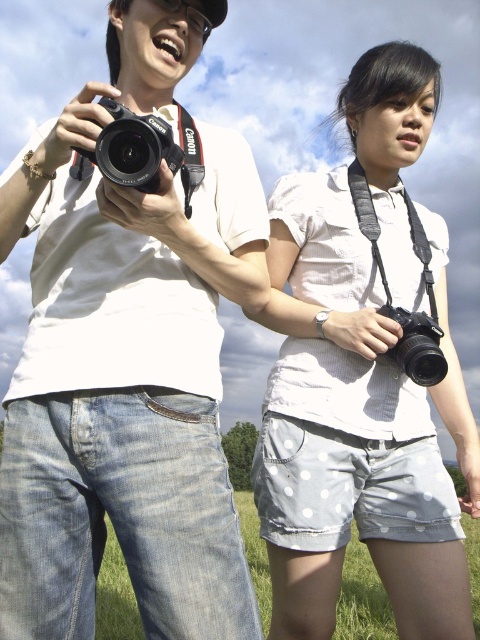
Question: Which object is closer to the camera taking this photo?

Choices:
 (A) matte black camera at left
 (B) black plastic camera at center
 (C) white dotted shorts at center
 (D) black matte camera at center

Answer: (B)

Question: Does black plastic camera at center lie in front of black matte camera at center?

Choices:
 (A) no
 (B) yes

Answer: (B)

Question: Estimate the real-world distances between objects in this image. Which object is farther from the matte black camera at left?

Choices:
 (A) green grass at lower center
 (B) black matte camera at center
 (C) black plastic camera at center
 (D) white dotted shorts at center

Answer: (A)

Question: Does matte black camera at left come behind black matte camera at center?

Choices:
 (A) yes
 (B) no

Answer: (B)

Question: Is matte black camera at left to the right of green grass at lower center from the viewer's perspective?

Choices:
 (A) yes
 (B) no

Answer: (B)

Question: Which object is farther from the camera taking this photo?

Choices:
 (A) green grass at lower center
 (B) black plastic camera at center
 (C) black matte camera at center

Answer: (A)